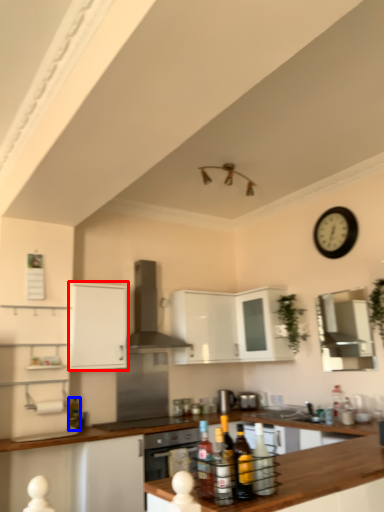
Question: Which object is further to the camera taking this photo, cabinetry (highlighted by a red box) or bottle (highlighted by a blue box)?

Choices:
 (A) cabinetry
 (B) bottle

Answer: (B)